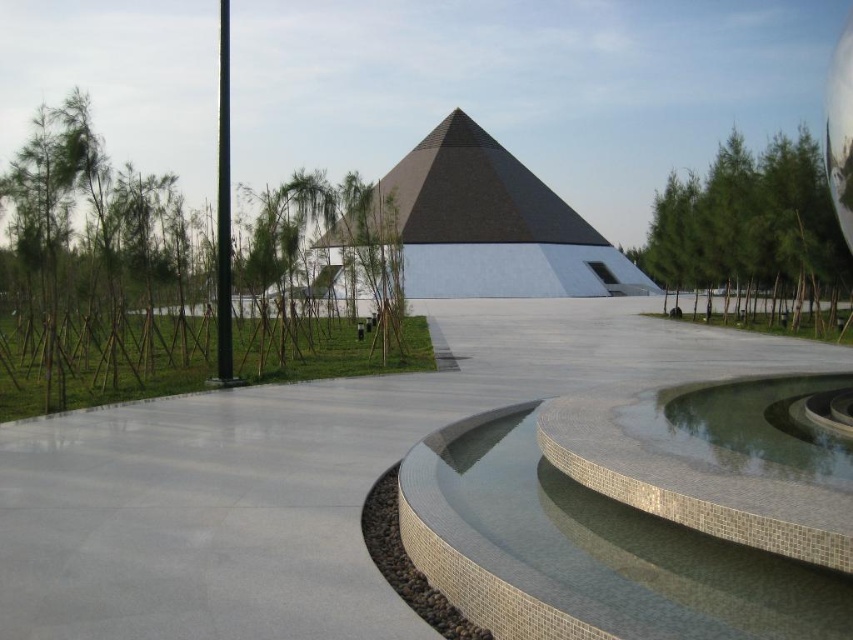
Looking at this image, you are an architect visiting the site and need to determine spatial relationships. Which object takes up more area in the image between the gray mosaic water at center and the green leafy tree at upper right?

The green leafy tree at upper right occupies more space than the gray mosaic water at center according to the description.

You are a visitor standing at the entrance of the pyramid building. You see the gray mosaic water at center and the green leafy tree at upper right. Which object is taller?

The green leafy tree at upper right is taller than the gray mosaic water at center.